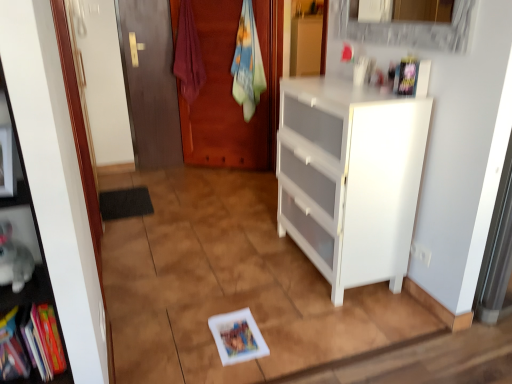
I want to click on empty space that is ontop of white matte book at center, acting as the 2th book starting from the right (from a real-world perspective), so click(239, 336).